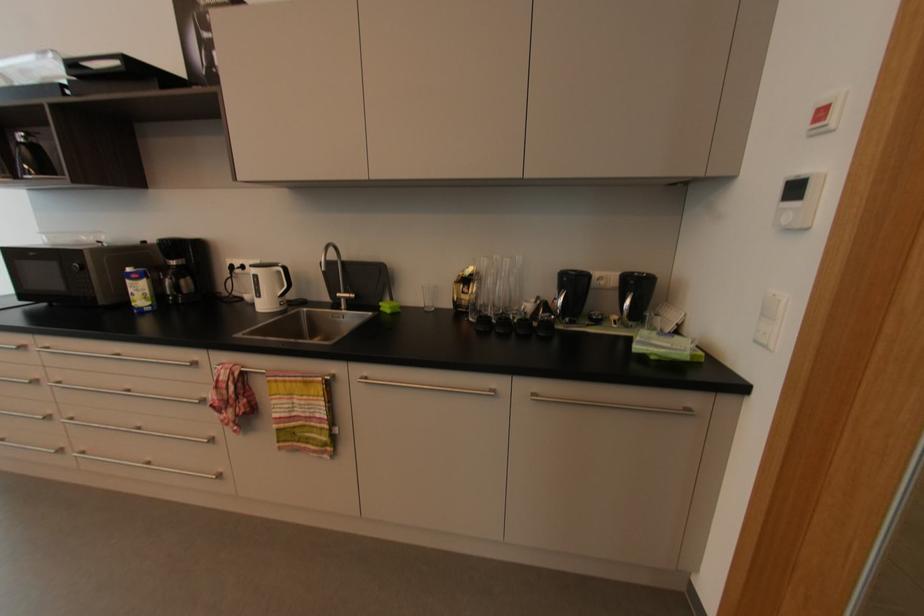
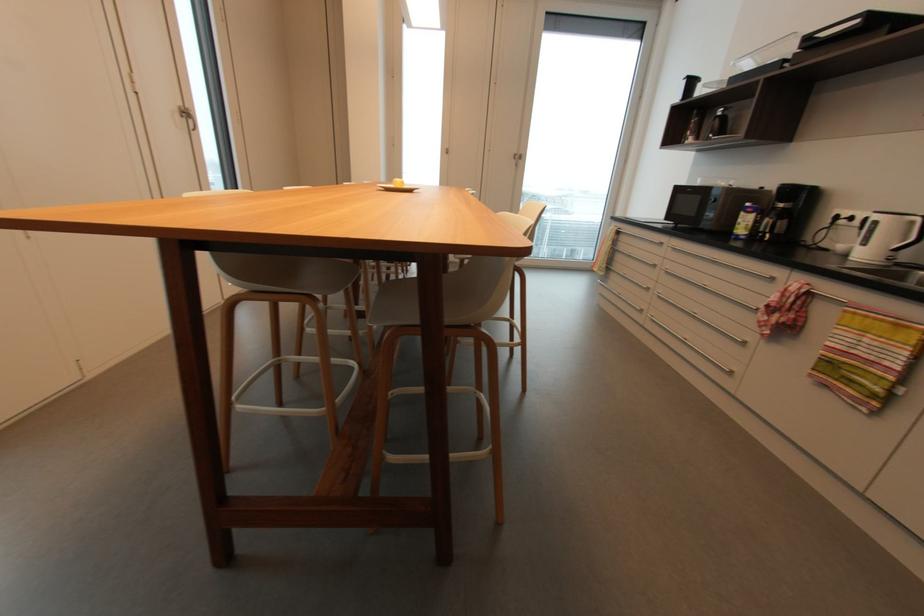
The point at (282, 273) is marked in the first image. Where is the corresponding point in the second image?

(916, 223)